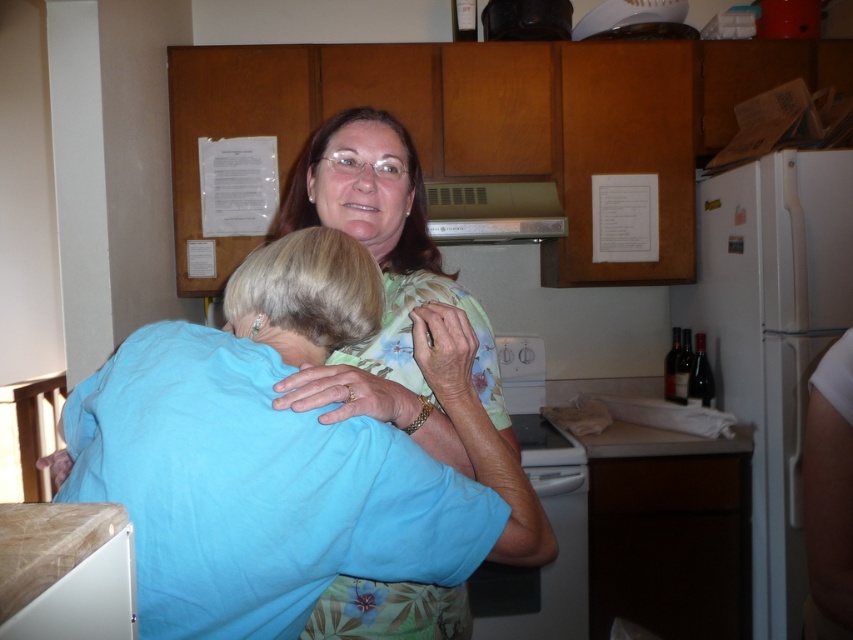
You are designing a kitchen layout and need to place both the floral print blouse at center and the white glossy dishwasher at center. Given their sizes, which object requires more horizontal space in the kitchen?

The floral print blouse at center requires more horizontal space because its width is larger than that of the white glossy dishwasher at center.

You are a delivery person who needs to place a package on the counter between the floral print blouse at center and the white glossy dishwasher at center. The package requires at least 5 feet of space. Is there enough room?

The floral print blouse at center is 4.39 feet from the white glossy dishwasher at center, so there is not enough space to place the package requiring at least 5 feet of space between them.

What is located at the coordinates point [318,464] in the image?

The light blue fabric shirt at center is located at point [318,464].